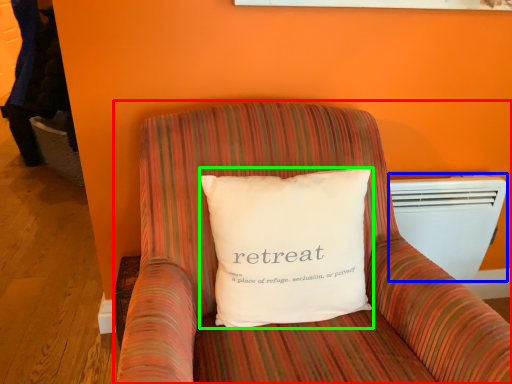
Question: Which object is the farthest from furniture (highlighted by a red box)? Choose among these: air conditioning (highlighted by a blue box) or pillow (highlighted by a green box).

Choices:
 (A) air conditioning
 (B) pillow

Answer: (A)